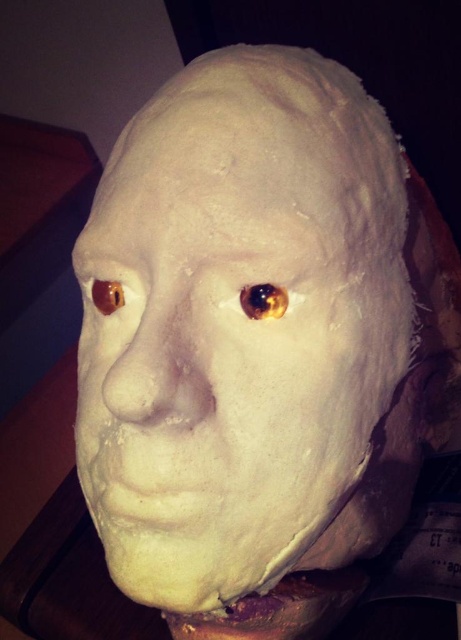
Who is higher up, shiny amber eye at center or translucent amber eye at upper left?

translucent amber eye at upper left

Can you confirm if shiny amber eye at center is positioned below translucent amber eye at upper left?

Yes.

Who is more distant from viewer, (255, 317) or (95, 298)?

The point (95, 298) is more distant.

Where is `shiny amber eye at center`? shiny amber eye at center is located at coordinates (264, 300).

Does matte white nose at center have a greater height compared to shiny amber eye at center?

Yes, matte white nose at center is taller than shiny amber eye at center.

Between point (111, 292) and point (254, 317), which one is positioned in front?

Point (254, 317)

Locate an element on the screen. matte white nose at center is located at coordinates (159, 371).

Between matte white nose at center and translucent amber eye at upper left, which one is positioned lower?

matte white nose at center is below.

The height and width of the screenshot is (640, 461). I want to click on matte white nose at center, so click(x=159, y=371).

This screenshot has height=640, width=461. Describe the element at coordinates (159, 371) in the screenshot. I see `matte white nose at center` at that location.

Locate an element on the screen. The height and width of the screenshot is (640, 461). matte white nose at center is located at coordinates click(x=159, y=371).